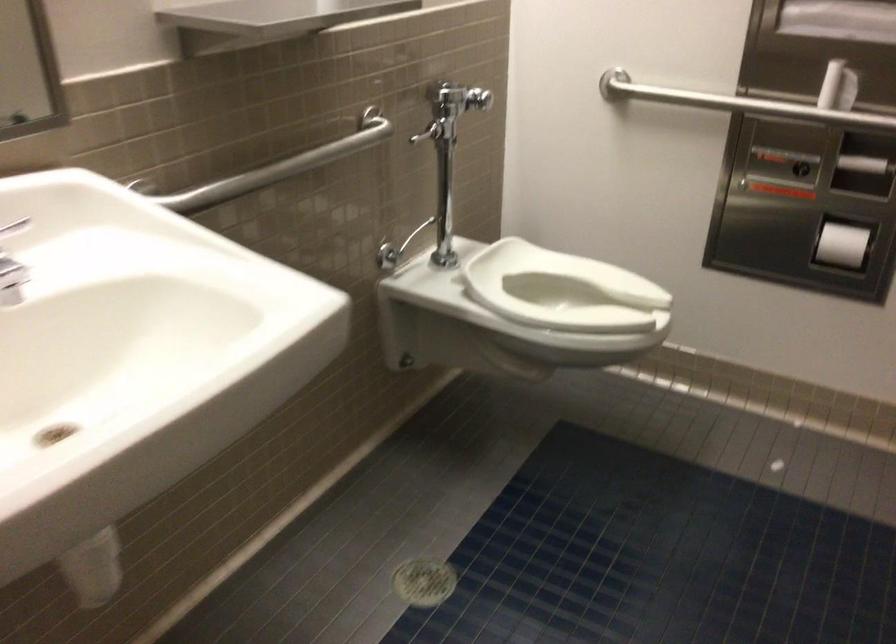
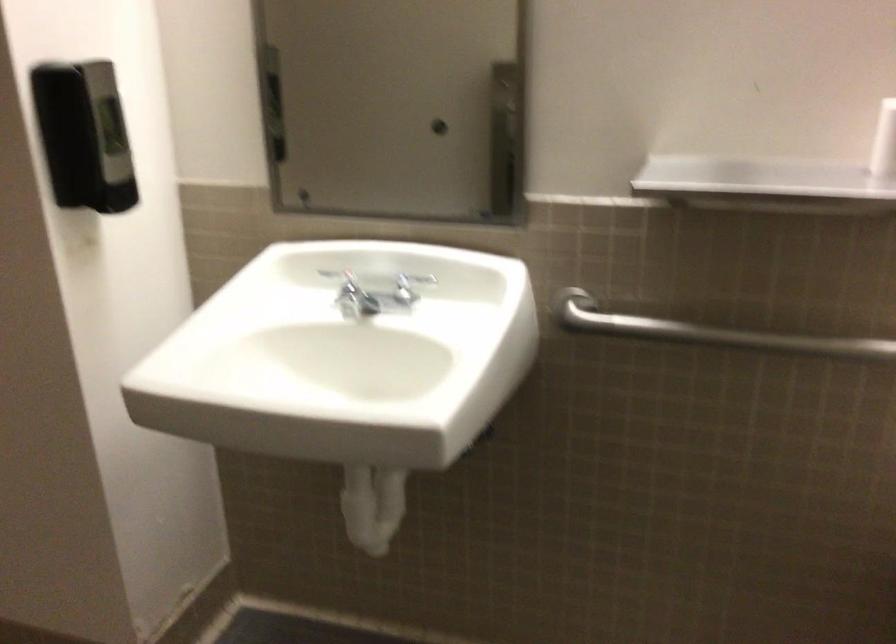
Locate, in the second image, the point that corresponds to [270,174] in the first image.

(707, 332)